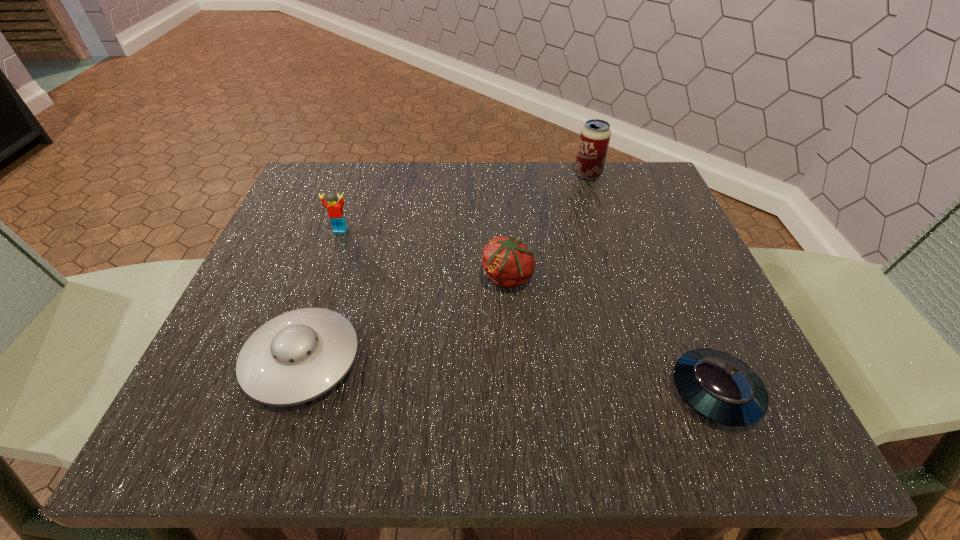
At what (x,y) coordinates should I click in order to perform the action: click on the tallest object. Please return your answer as a coordinate pair (x, y). Looking at the image, I should click on (595, 136).

The image size is (960, 540). In order to click on the farthest object in this screenshot , I will do `click(595, 136)`.

Locate an element on the screen. This screenshot has height=540, width=960. the second farthest object is located at coordinates (335, 211).

Locate an element on the screen. The height and width of the screenshot is (540, 960). tomato is located at coordinates (508, 263).

Image resolution: width=960 pixels, height=540 pixels. What are the coordinates of `the third object from left to right` in the screenshot? It's located at (508, 263).

This screenshot has height=540, width=960. What are the coordinates of `the left saucer` in the screenshot? It's located at (297, 356).

What are the coordinates of `the taller saucer` in the screenshot? It's located at (297, 356).

Locate an element on the screen. This screenshot has height=540, width=960. the right saucer is located at coordinates (722, 388).

Identify the location of the shortest object. The height and width of the screenshot is (540, 960). (722, 388).

Locate an element on the screen. free space located 0.280m on the left of the farthest object is located at coordinates (458, 174).